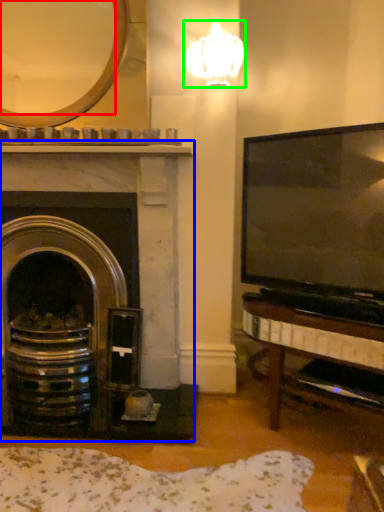
Question: Based on their relative distances, which object is farther from mirror (highlighted by a red box)? Choose from fireplace (highlighted by a blue box) and lamp (highlighted by a green box).

Choices:
 (A) fireplace
 (B) lamp

Answer: (A)